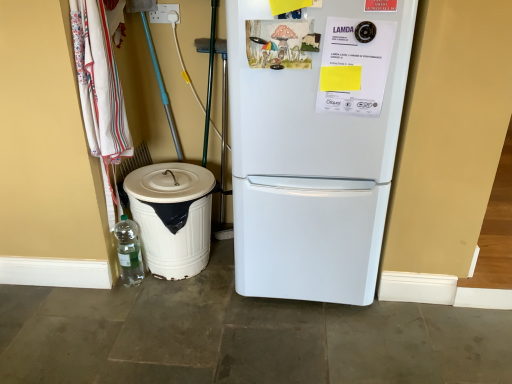
Question: From a real-world perspective, is white plastic electric outlet at upper center above or below white matte refrigerator at center?

Choices:
 (A) above
 (B) below

Answer: (A)

Question: Is white plastic electric outlet at upper center to the left or to the right of white matte refrigerator at center in the image?

Choices:
 (A) right
 (B) left

Answer: (B)

Question: Based on their relative distances, which object is farther from the white plastic electric outlet at upper center?

Choices:
 (A) white fabric laundry at left
 (B) white plastic trash can at lower left
 (C) clear plastic bottle at lower left
 (D) white matte refrigerator at center

Answer: (D)

Question: Which object is the farthest from the white matte refrigerator at center?

Choices:
 (A) white fabric laundry at left
 (B) clear plastic bottle at lower left
 (C) white plastic trash can at lower left
 (D) white plastic electric outlet at upper center

Answer: (D)